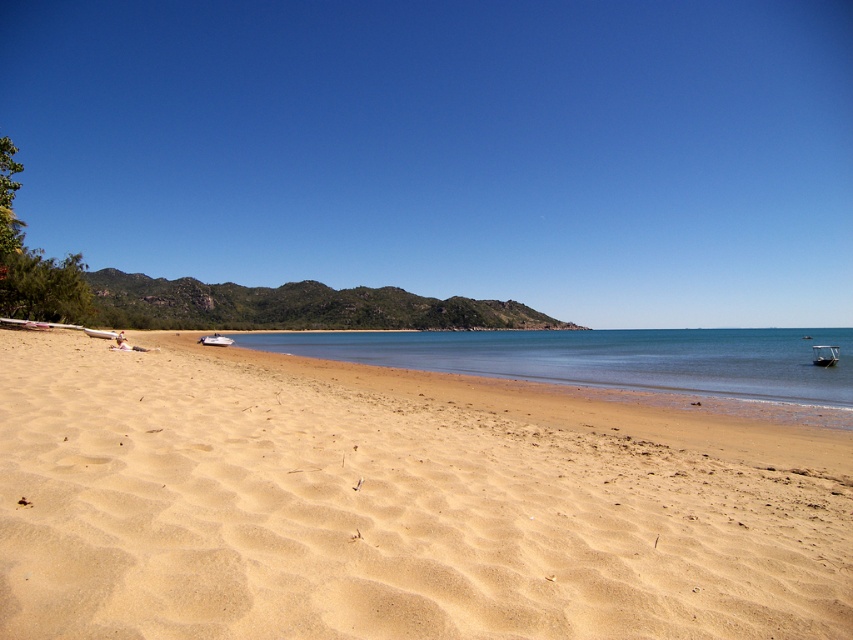
Does white plastic boat at center have a greater height compared to white plastic boat at lower left?

Yes, white plastic boat at center is taller than white plastic boat at lower left.

Between white plastic boat at center and white plastic boat at lower left, which one is positioned higher?

white plastic boat at lower left is above.

What do you see at coordinates (213, 339) in the screenshot? I see `white plastic boat at center` at bounding box center [213, 339].

You are a GUI agent. You are given a task and a screenshot of the screen. Output one action in this format:
    pyautogui.click(x=<x>, y=<y>)
    Task: Click on the white plastic boat at center
    
    Given the screenshot: What is the action you would take?
    pyautogui.click(x=213, y=339)

Does metallic silver boat at lower right appear on the left side of white plastic boat at center?

No, metallic silver boat at lower right is not to the left of white plastic boat at center.

Does metallic silver boat at lower right have a lesser width compared to white plastic boat at center?

Correct, metallic silver boat at lower right's width is less than white plastic boat at center's.

Measure the distance between metallic silver boat at lower right and camera.

The distance of metallic silver boat at lower right from camera is 34.12 meters.

Find the location of a particular element. metallic silver boat at lower right is located at coordinates (825, 355).

Is sandy beach at lower left bigger than white plastic boat at lower left?

Indeed, sandy beach at lower left has a larger size compared to white plastic boat at lower left.

You are a GUI agent. You are given a task and a screenshot of the screen. Output one action in this format:
    pyautogui.click(x=<x>, y=<y>)
    Task: Click on the sandy beach at lower left
    This screenshot has height=640, width=853.
    Given the screenshot: What is the action you would take?
    pyautogui.click(x=397, y=502)